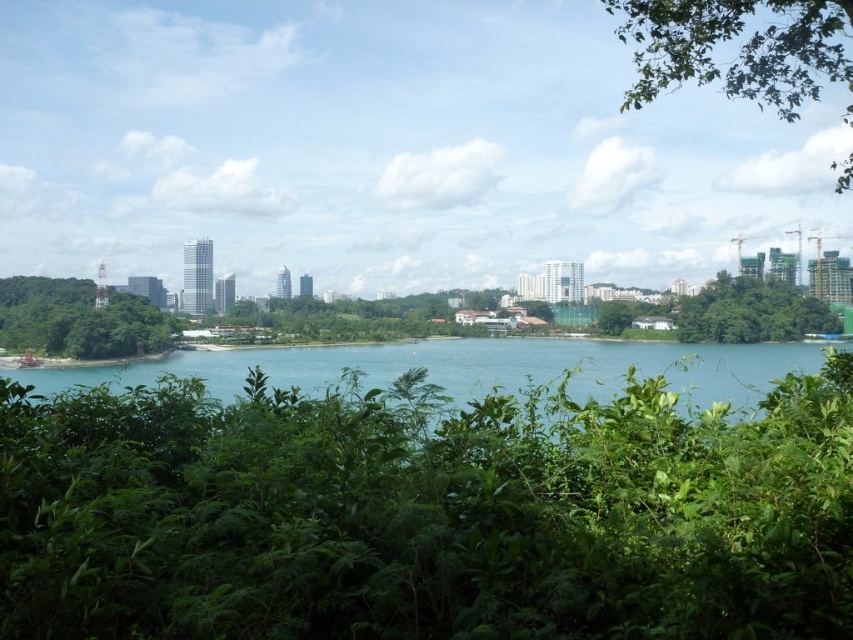
You are a bird flying over the waterfront area. You want to land on the closest tree to rest. Which tree should you choose between the green leafy tree at upper right and the green leafy tree at left?

The green leafy tree at upper right is closer to you because it is in front of the green leafy tree at left, so you should choose the green leafy tree at upper right to land.

Based on the photo, you are an urban planner analyzing the waterfront area. Based on the image, where is the green leafy vegetation at center located in terms of its 2D coordinates?

The green leafy vegetation at center is located at the 2D coordinates of point (424, 513).

You are a landscape architect designing a walking path through the waterfront area. The path must pass between the green leafy vegetation at center and the green leafy tree at upper right. Based on their widths, which object might require more careful planning to ensure the path remains wide enough for visitors?

The green leafy vegetation at center might require more careful planning since it is wider than the green leafy tree at upper right, potentially narrowing the available space for the path.